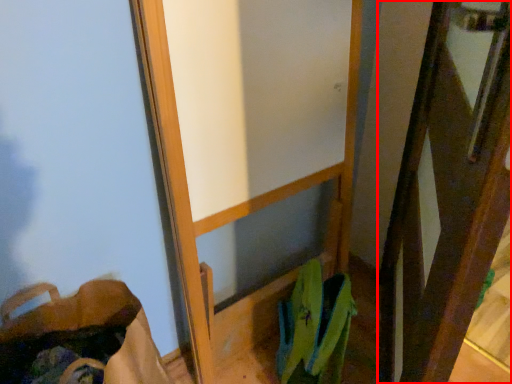
Question: From the image's perspective, where is screen door (annotated by the red box) located relative to shoulder bag?

Choices:
 (A) below
 (B) above

Answer: (B)